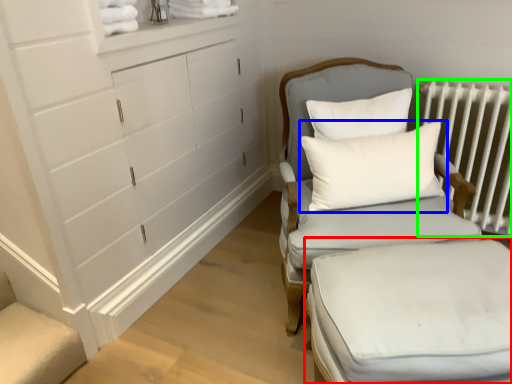
Question: Which object is positioned farthest from changing table (highlighted by a red box)? Select from pillow (highlighted by a blue box) and radiator (highlighted by a green box).

Choices:
 (A) pillow
 (B) radiator

Answer: (B)